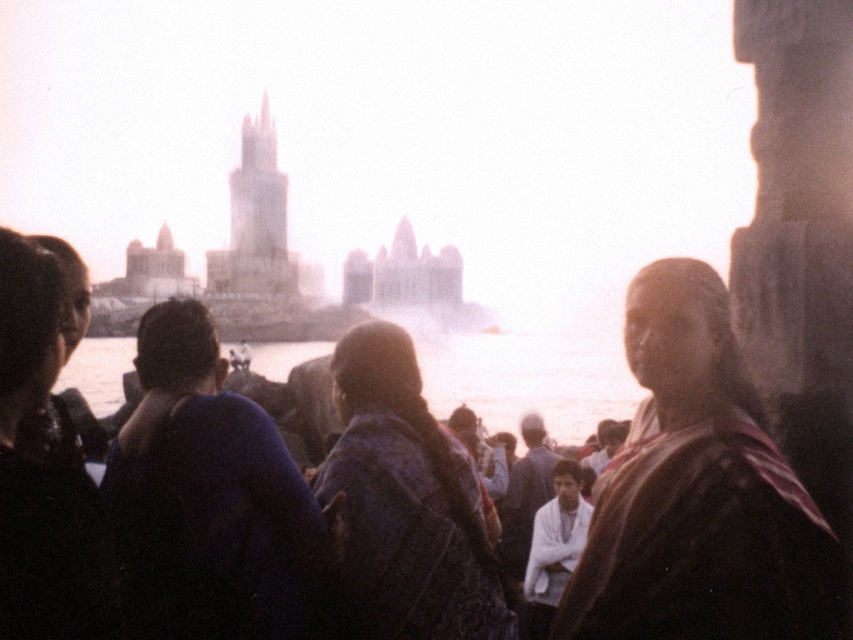
You are standing at the center of the scene looking towards the temple. There is a point marked at coordinates (41,472) in the image. What object is located at this point?

The point at coordinates (41,472) indicates a black fabric at left.

You are a photographer standing at the center of the scene. You want to take a photo that includes both the patterned fabric scarf at center and the white cotton shirt at center. Given that your camera has a maximum zoom range that can capture objects up to 20 meters apart, will you be able to capture both subjects in a single frame without moving?

The patterned fabric scarf at center and white cotton shirt at center are 22.86 meters apart from each other, which exceeds the camera maximum zoom range of 20 meters. Therefore, you cannot capture both subjects in a single frame without moving.

You are an observer standing in front of the stone archway. You see the black fabric at left and the white cotton shirt at center. Which object is taller?

The black fabric at left is taller than the white cotton shirt at center.